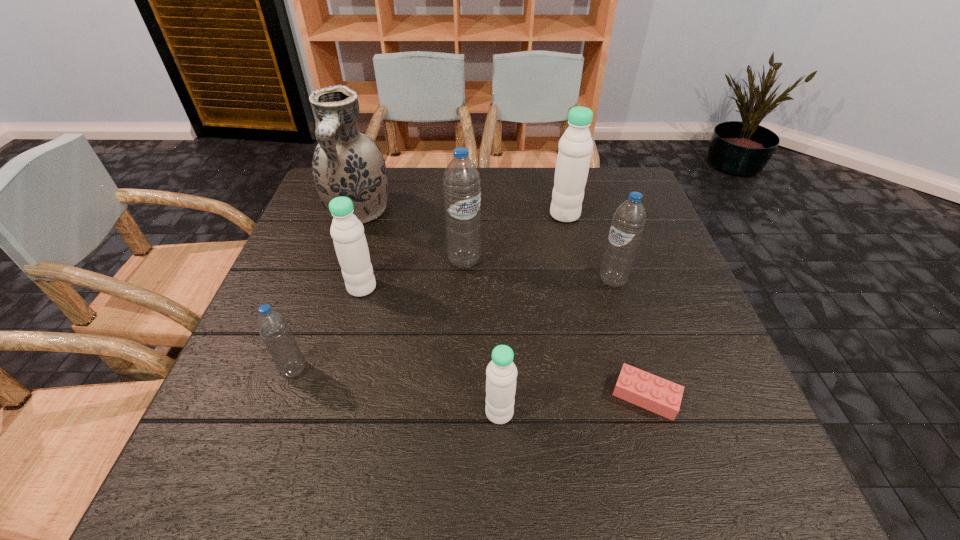
Locate an element on the screen. This screenshot has width=960, height=540. vacant space at the far edge is located at coordinates 417,180.

What are the coordinates of `free space at the left edge` in the screenshot? It's located at (263, 389).

In the image, there is a desktop. What are the coordinates of `vacant area at the right edge` in the screenshot? It's located at (655, 219).

In order to click on vacant space at the near left corner of the desktop in this screenshot , I will do `click(288, 449)`.

The height and width of the screenshot is (540, 960). What are the coordinates of `free region at the far right corner of the desktop` in the screenshot? It's located at (634, 180).

I want to click on free space at the near right corner of the desktop, so pos(725,465).

Where is `free area in between the second nearest water bottle and the Lego`? Image resolution: width=960 pixels, height=540 pixels. free area in between the second nearest water bottle and the Lego is located at coordinates (469, 383).

You are a GUI agent. You are given a task and a screenshot of the screen. Output one action in this format:
    pyautogui.click(x=<x>, y=<y>)
    Task: Click on the unoccupied position between the nearest blue water bottle and the nearest water bottle
    This screenshot has width=960, height=540.
    Given the screenshot: What is the action you would take?
    pyautogui.click(x=396, y=391)

This screenshot has width=960, height=540. What are the coordinates of `free spot between the blue vase and the second white water bottle from right to left` in the screenshot? It's located at (429, 312).

Where is `vacant space in between the smallest blue water bottle and the vase`? This screenshot has height=540, width=960. vacant space in between the smallest blue water bottle and the vase is located at coordinates (326, 291).